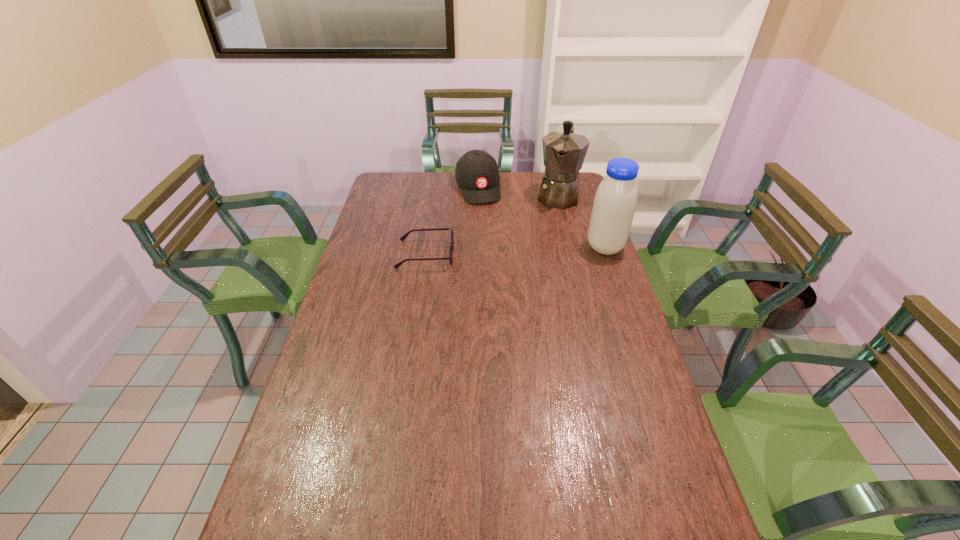
In the image, there is a desktop. Where is `free space at the right edge`? The image size is (960, 540). free space at the right edge is located at coordinates (645, 402).

In the image, there is a desktop. In order to click on vacant space at the far left corner in this screenshot , I will do `click(396, 193)`.

The width and height of the screenshot is (960, 540). In the image, there is a desktop. Identify the location of free space at the near left corner. (274, 507).

Where is `vacant point located between the soya milk and the coffeepot`? The height and width of the screenshot is (540, 960). vacant point located between the soya milk and the coffeepot is located at coordinates (582, 221).

Image resolution: width=960 pixels, height=540 pixels. What are the coordinates of `vacant area that lies between the coffeepot and the second shortest object` in the screenshot? It's located at (517, 192).

The width and height of the screenshot is (960, 540). What are the coordinates of `vacant area that lies between the coffeepot and the shortest object` in the screenshot? It's located at (492, 225).

Locate an element on the screen. This screenshot has height=540, width=960. free space that is in between the soya milk and the baseball cap is located at coordinates (541, 218).

Locate an element on the screen. free space between the soya milk and the second shortest object is located at coordinates (541, 218).

The width and height of the screenshot is (960, 540). Identify the location of free space between the shortest object and the coffeepot. (492, 225).

In order to click on free space between the third tallest object and the spectacles in this screenshot , I will do (451, 221).